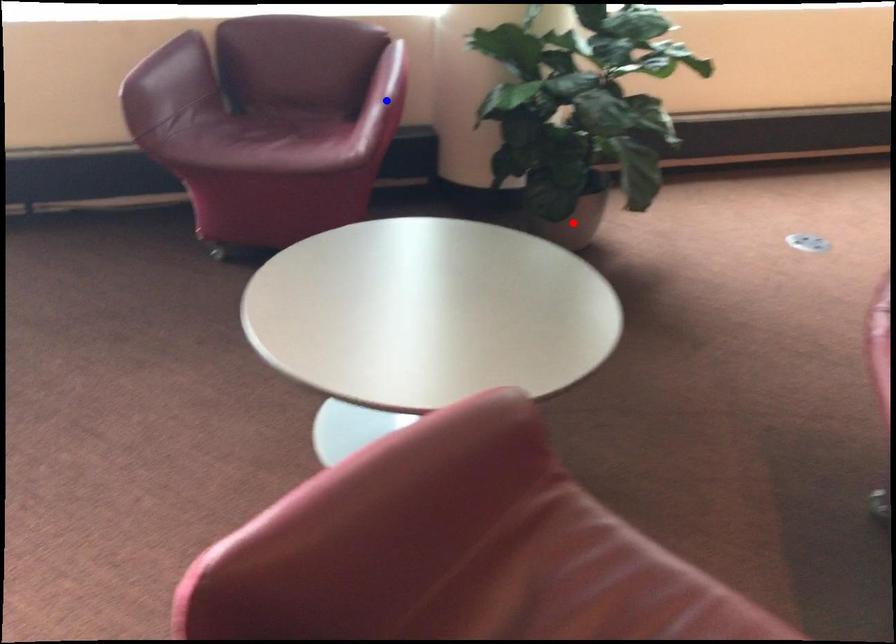
Question: Which of the two points in the image is closer to the camera?

Choices:
 (A) Blue point is closer.
 (B) Red point is closer.

Answer: (A)